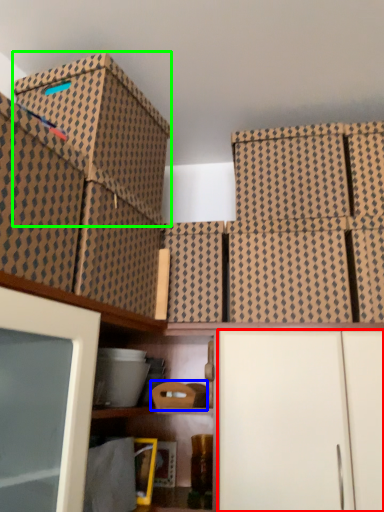
Question: Which is nearer to the cabinetry (highlighted by a red box)? storage box (highlighted by a blue box) or storage box (highlighted by a green box).

Choices:
 (A) storage box
 (B) storage box

Answer: (A)